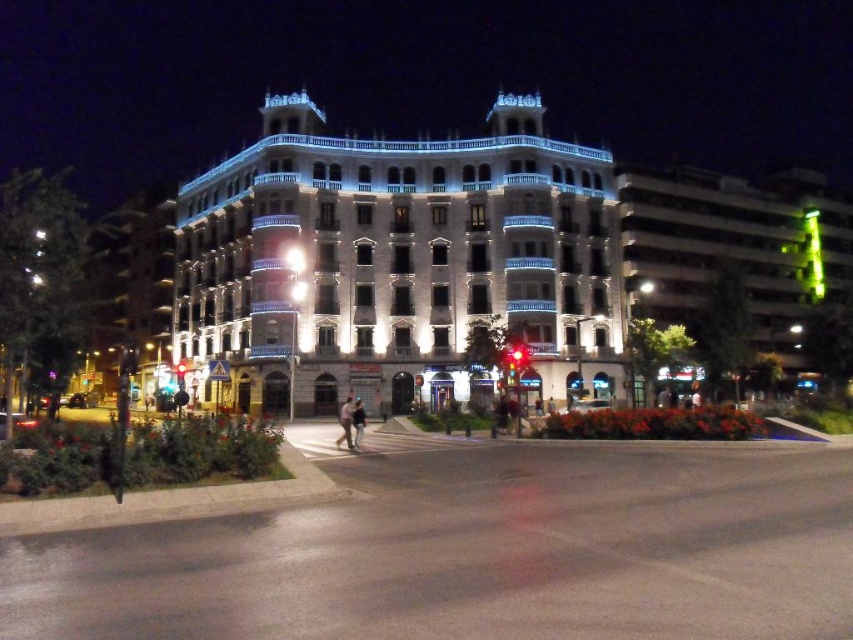
You are standing at the crosswalk in front of the white glossy building at center. If you face the building, which direction should you walk to reach the entrance located at the bottom of the building?

Since the entrance is located at the bottom of the white glossy building at center, you should walk towards the lower part of the building, which would be directly towards the base of the building facing you.

You are standing on the pedestrian crossing and see the white glossy building at center and the brown leather jacket at center. Which object is positioned to the left from your perspective?

The white glossy building at center is positioned to the left of the brown leather jacket at center from your perspective.